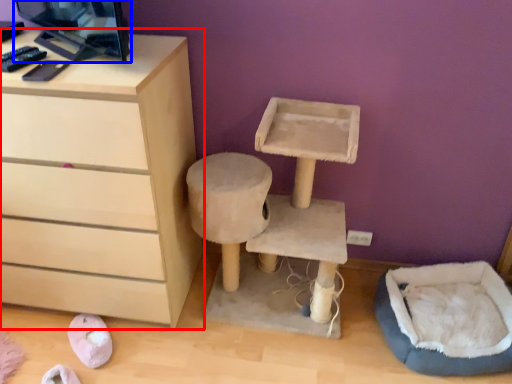
Question: Which point is closer to the camera, chest of drawers (highlighted by a red box) or desktop computer (highlighted by a blue box)?

Choices:
 (A) chest of drawers
 (B) desktop computer

Answer: (B)